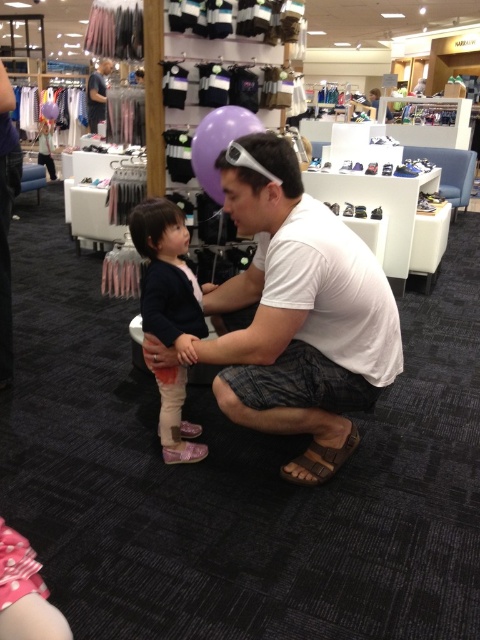
You are a delivery person who needs to place a 1.5 meter long box in the foreground of the scene. Can the white fabric shirt at center be moved to accommodate the box without moving other objects?

The white fabric shirt at center is 1.46 meters away from the camera, so moving it would allow space for the 1.5 meter box since the shirt is closer than the box length.

You are a customer in the store and want to compare the height of the matte dark blue sweater at center and the dark blue shirt at upper left. Which one is taller?

The dark blue shirt at upper left is taller than the matte dark blue sweater at center.

Based on the photo, you are a customer in the store looking for a shirt to buy. You see the white fabric shirt at center and the matte dark blue sweater at center. Which one is closer to you?

The white fabric shirt at center is closer to you because it is in front of the matte dark blue sweater at center.